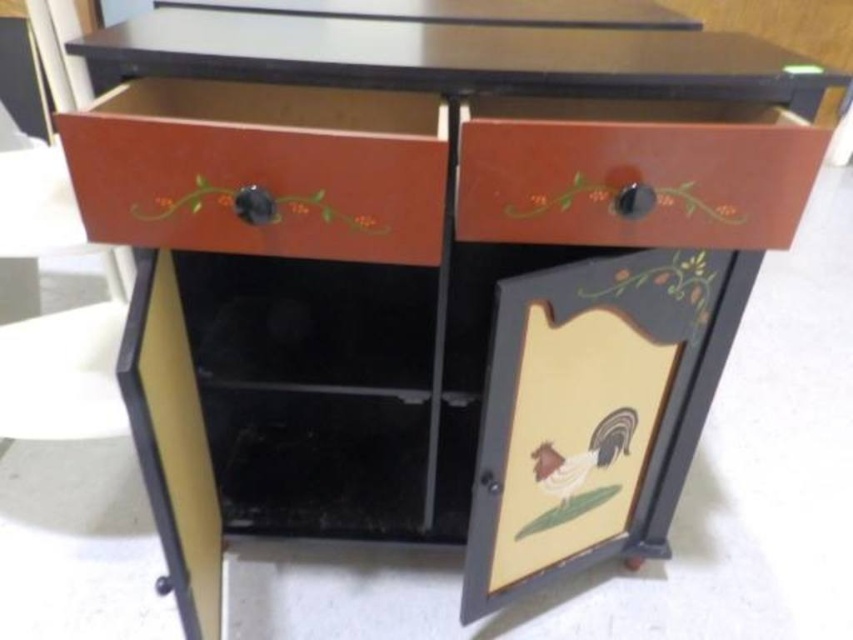
What are the coordinates of the matte wood drawer at upper left?

The coordinates of the matte wood drawer at upper left are at point [260,168].

You are organizing items in the cabinet and need to place a small vase on the top shelf. Which drawer, the matte wood drawer at upper left or the matte brown drawer at upper right, is positioned higher and thus closer to the shelf?

The matte wood drawer at upper left is positioned above the matte brown drawer at upper right, so it is closer to the top shelf.